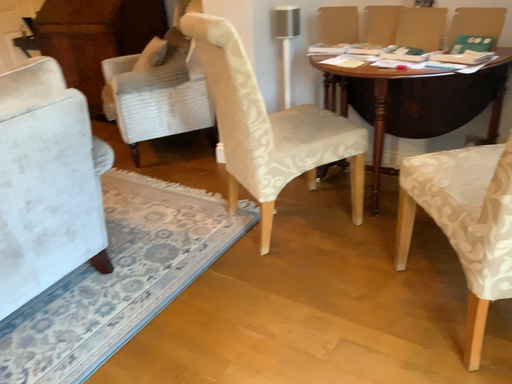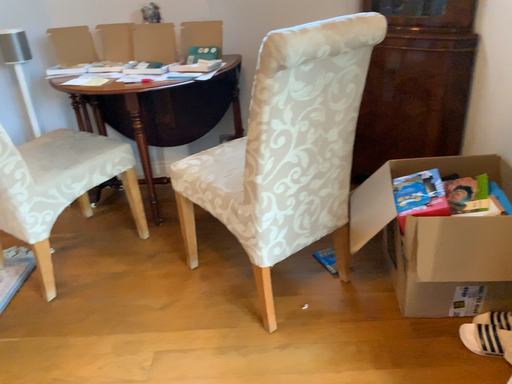
Question: Which way did the camera rotate in the video?

Choices:
 (A) rotated right
 (B) rotated left

Answer: (A)